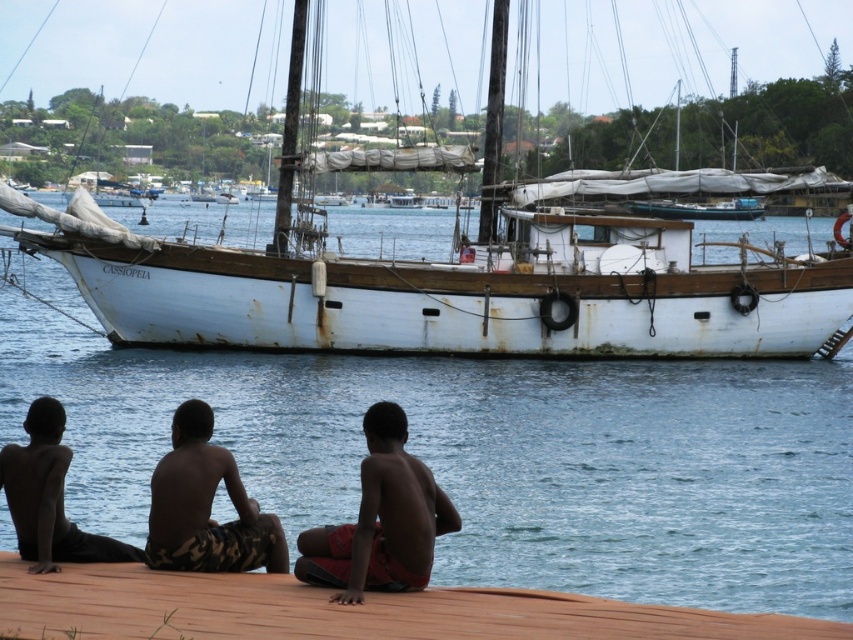
You are a photographer trying to capture a wide shot of the rusty wooden sailboat at center and the brown wooden dock at lower center. Given that the sailboat is wider than the dock, which object will require more horizontal space in the frame to fully capture its width?

The rusty wooden sailboat at center requires more horizontal space in the frame because its width surpasses that of the brown wooden dock at lower center.